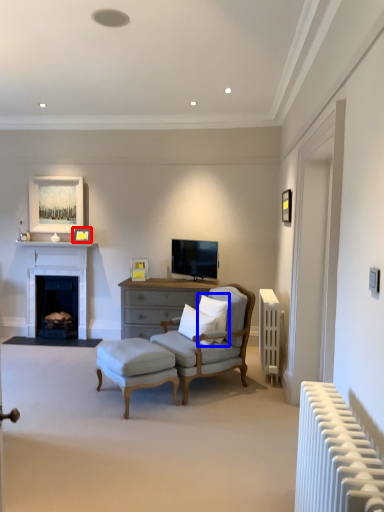
Question: Which object is further to the camera taking this photo, picture frame (highlighted by a red box) or pillow (highlighted by a blue box)?

Choices:
 (A) picture frame
 (B) pillow

Answer: (A)